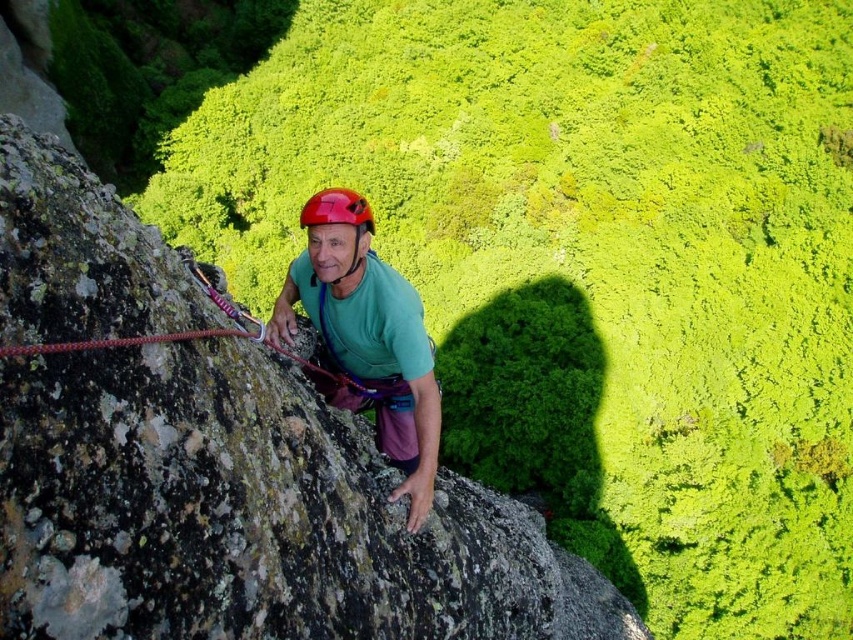
You are a drone operator trying to capture a closeup shot of the climber. The drone is currently at position 0.5, 0.5. The green matte helmet at center is at point 0.525, 0.431. To get the best shot, you need to adjust the drone to the same horizontal level as the helmet. Should you move the drone left or right?

The green matte helmet at center is located at point 0.525 on the x axis, while the drone is at 0.5. Since 0.525 is to the right of 0.5, you should move the drone slightly to the right to align horizontally with the green matte helmet at center.

You are standing at the base of the rock face and want to reach the point marked as point (x=354, y=371). If your maximum reach is 8 meters, can you touch that point without moving closer?

The distance of point (x=354, y=371) from the viewer is 7.91 meters, so yes, you can touch it since it is within your 8 meter reach.